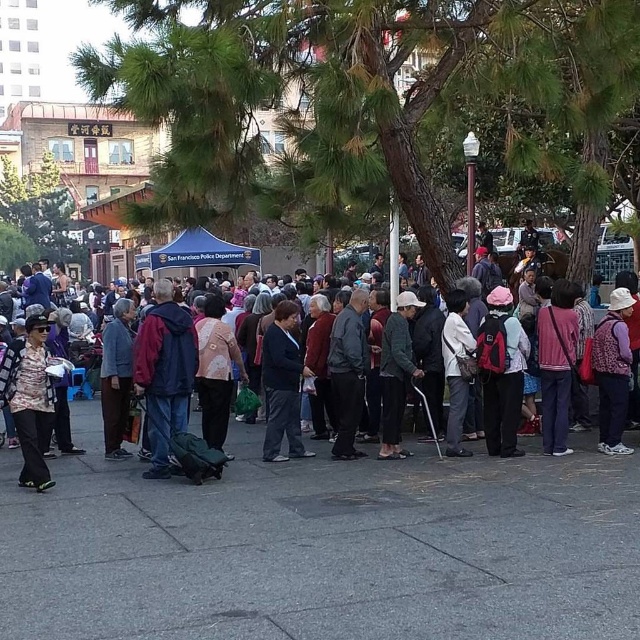
The height and width of the screenshot is (640, 640). Describe the element at coordinates (348, 372) in the screenshot. I see `dark gray jacket at center` at that location.

Between point (336, 358) and point (209, 394), which one is positioned in front?

Point (209, 394)

The width and height of the screenshot is (640, 640). I want to click on dark gray jacket at center, so click(x=348, y=372).

Find the location of a particular element. dark gray jacket at center is located at coordinates (348, 372).

Which is below, dark blue jacket at center or matte pink sweater at center?

matte pink sweater at center

Does dark blue jacket at center have a greater height compared to matte pink sweater at center?

Yes, dark blue jacket at center is taller than matte pink sweater at center.

Which is in front, point (141, 333) or point (218, 304)?

Point (141, 333)

You are a GUI agent. You are given a task and a screenshot of the screen. Output one action in this format:
    pyautogui.click(x=<x>, y=<y>)
    Task: Click on the dark blue jacket at center
    Image resolution: width=640 pixels, height=640 pixels.
    Given the screenshot: What is the action you would take?
    pyautogui.click(x=164, y=372)

Which is behind, point (492, 314) or point (214, 406)?

The point (214, 406) is behind.

The image size is (640, 640). What do you see at coordinates (502, 378) in the screenshot?
I see `pink fabric backpack at center` at bounding box center [502, 378].

Identify the location of pink fabric backpack at center. This screenshot has height=640, width=640. (502, 378).

Image resolution: width=640 pixels, height=640 pixels. What are the coordinates of `pink fabric backpack at center` in the screenshot? It's located at (502, 378).